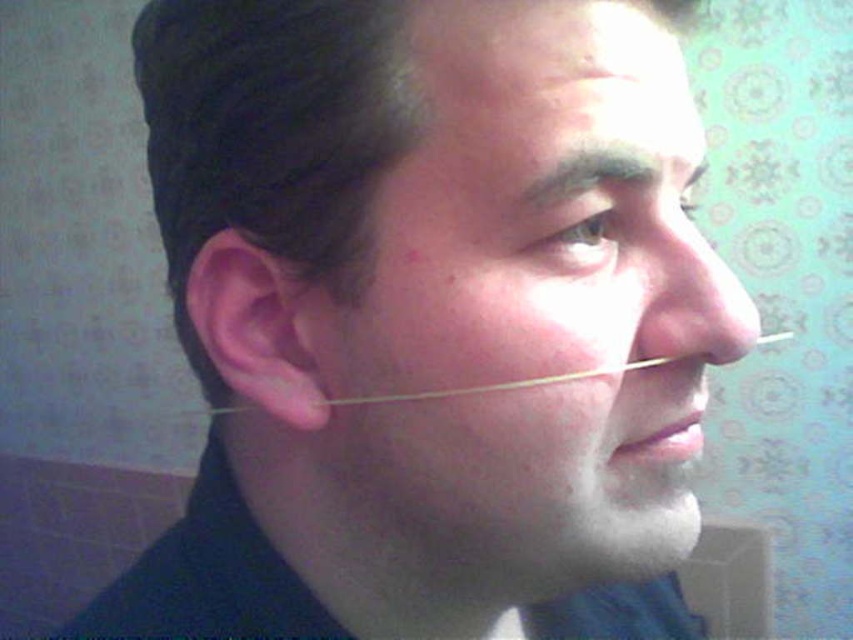
You are a medical professional examining the image. You need to locate the point with coordinates (531, 307) on the person. Where is this point located?

The point at coordinates (531, 307) corresponds to the smooth skin face at center.

Based on the photo, you are a medical professional assessing a patient. You observe the smooth skin face at center and the clear plastic tube at nose. Which object has a larger height?

The smooth skin face at center has a greater height compared to the clear plastic tube at nose.

You are a medical professional examining a patient. You notice the dark brown hair at upper center and the clear plastic tube at nose. Which object takes up more space in the image?

The clear plastic tube at nose occupies more space than the dark brown hair at upper center according to the description.